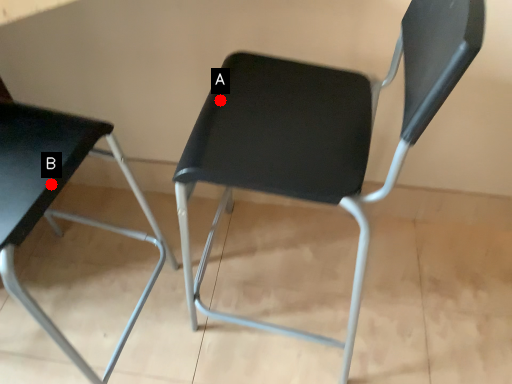
Question: Two points are circled on the image, labeled by A and B beside each circle. Among these points, which one is farthest from the camera?

Choices:
 (A) A is further
 (B) B is further

Answer: (A)